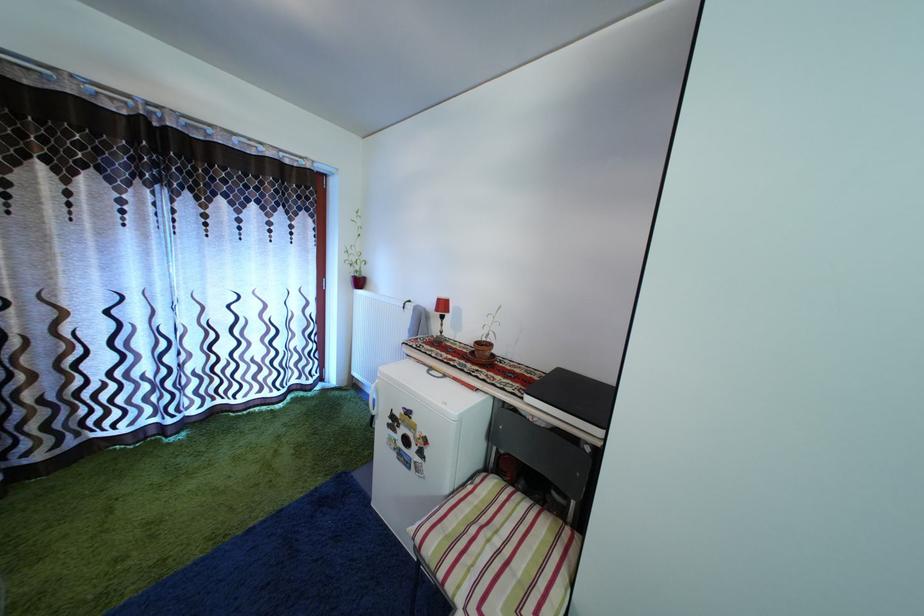
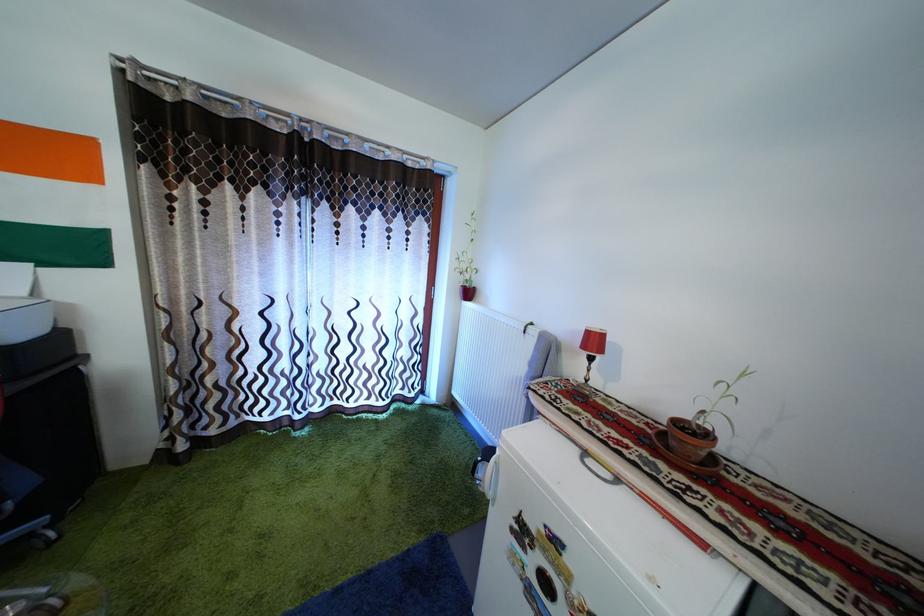
Find the pixel in the second image that matches point 446,308 in the first image.

(598, 339)